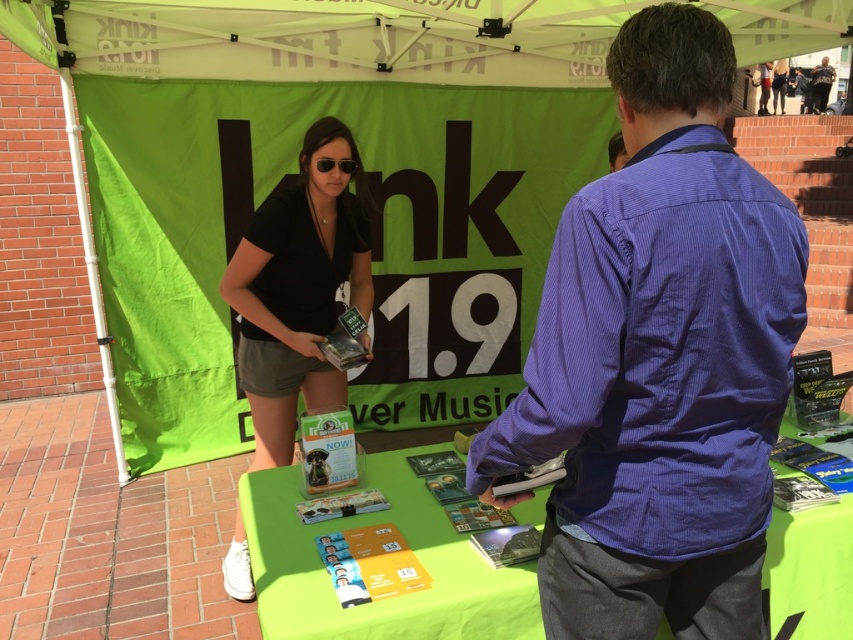
You are a visitor at this event and want to know which object is taller between the purple shirt at center and the green fabric canopy at upper center. Can you tell me?

The purple shirt at center is much taller than the green fabric canopy at upper center.

Consider the image. You are attending an outdoor event and want to pick up a pamphlet from the table. The woman is holding a black plastic sunglasses at upper center. Where should you look to find the green fabric table at center?

The green fabric table at center is located below the black plastic sunglasses at upper center, so you should look downward from the sunglasses to find the table.